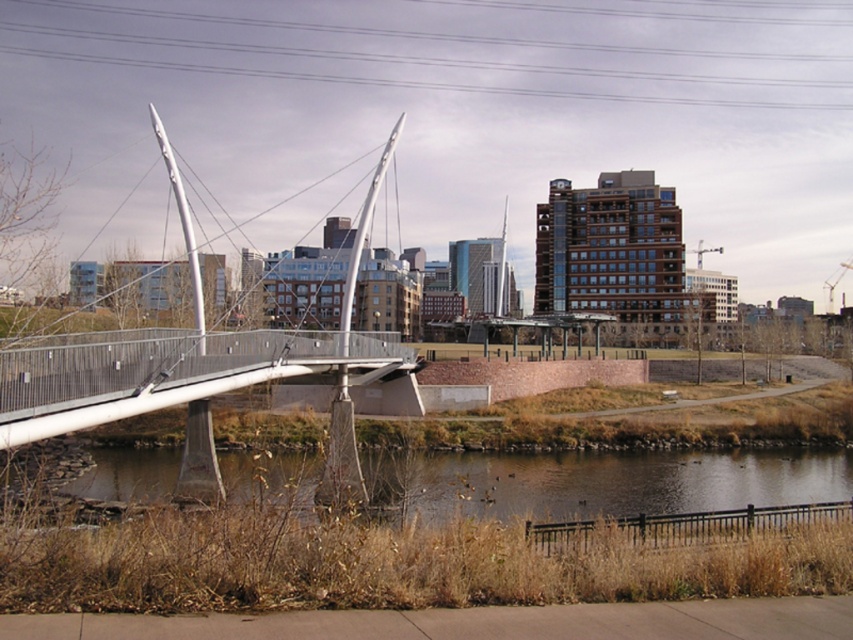
Question: Can you confirm if polished steel bridge at left is thinner than brown grassy river at lower center?

Choices:
 (A) no
 (B) yes

Answer: (A)

Question: Does polished steel bridge at left have a greater width compared to brown grassy river at lower center?

Choices:
 (A) no
 (B) yes

Answer: (B)

Question: Which point is farther to the camera?

Choices:
 (A) brown grassy river at lower center
 (B) polished steel bridge at left

Answer: (B)

Question: Can you confirm if polished steel bridge at left is positioned to the left of brown grassy river at lower center?

Choices:
 (A) no
 (B) yes

Answer: (B)